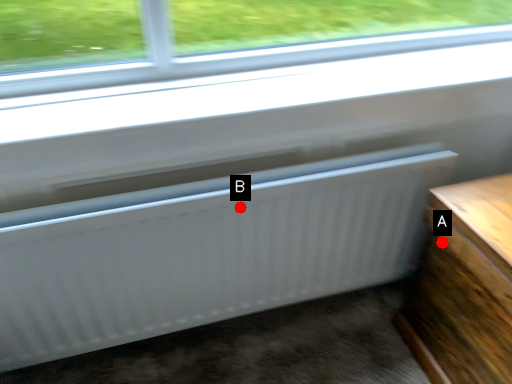
Question: Two points are circled on the image, labeled by A and B beside each circle. Which point is closer to the camera?

Choices:
 (A) A is closer
 (B) B is closer

Answer: (B)